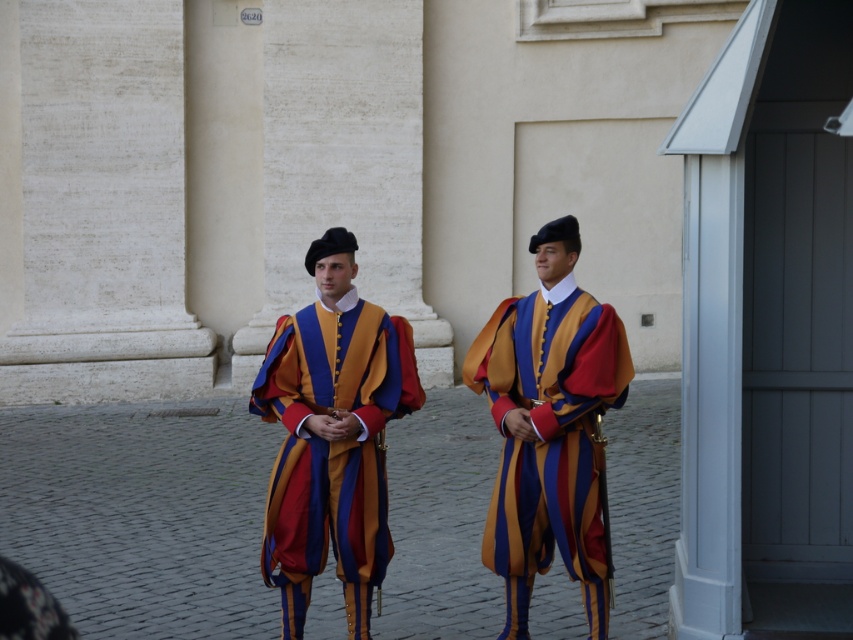
Question: Does matte velvet uniform at center have a smaller size compared to matte striped uniform at center?

Choices:
 (A) no
 (B) yes

Answer: (B)

Question: Which point is closer to the camera taking this photo?

Choices:
 (A) (340, 480)
 (B) (569, 324)

Answer: (B)

Question: Is matte velvet uniform at center above matte striped uniform at center?

Choices:
 (A) no
 (B) yes

Answer: (A)

Question: Which of the following is the closest to the observer?

Choices:
 (A) matte velvet uniform at center
 (B) matte striped uniform at center

Answer: (B)

Question: Is matte velvet uniform at center wider than matte striped uniform at center?

Choices:
 (A) yes
 (B) no

Answer: (A)

Question: Which object is closer to the camera taking this photo?

Choices:
 (A) matte velvet uniform at center
 (B) matte striped uniform at center

Answer: (B)